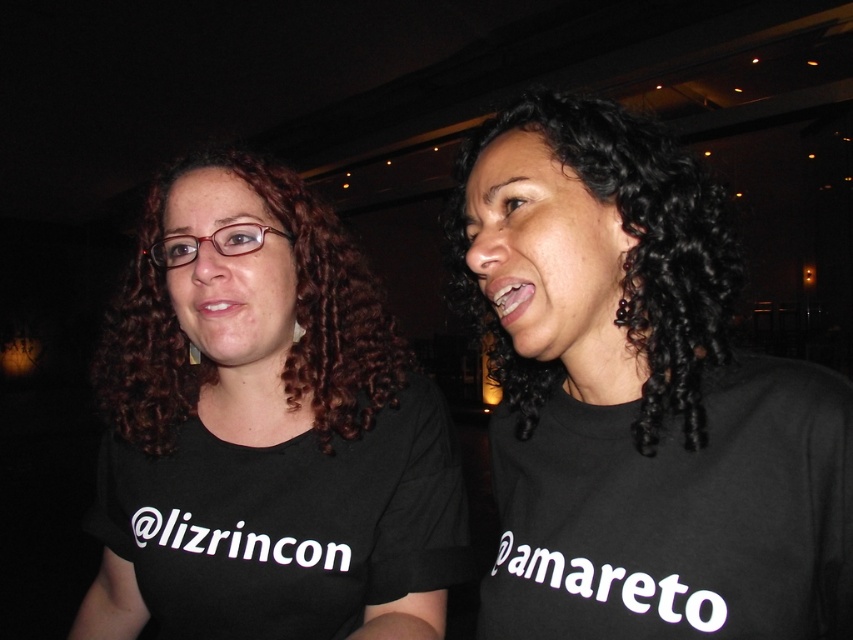
This screenshot has width=853, height=640. What do you see at coordinates (264, 429) in the screenshot?
I see `black matte t-shirt at left` at bounding box center [264, 429].

Based on the photo, between black matte t-shirt at left and black curly hair at center, which one is positioned higher?

black curly hair at center is above.

You are a GUI agent. You are given a task and a screenshot of the screen. Output one action in this format:
    pyautogui.click(x=<x>, y=<y>)
    Task: Click on the black matte t-shirt at left
    
    Given the screenshot: What is the action you would take?
    click(x=264, y=429)

At what (x,y) coordinates should I click in order to perform the action: click on black matte t-shirt at left. Please return your answer as a coordinate pair (x, y). This screenshot has width=853, height=640. Looking at the image, I should click on (264, 429).

Can you confirm if black matte shirt at center is positioned above black matte t-shirt at left?

Yes, black matte shirt at center is above black matte t-shirt at left.

Does black matte shirt at center have a larger size compared to black matte t-shirt at left?

No, black matte shirt at center is not bigger than black matte t-shirt at left.

At what (x,y) coordinates should I click in order to perform the action: click on black matte shirt at center. Please return your answer as a coordinate pair (x, y). This screenshot has height=640, width=853. Looking at the image, I should click on (639, 396).

Identify the location of black matte shirt at center. (639, 396).

Between black matte shirt at center and black cotton t-shirt at upper right, which one has less height?

With less height is black cotton t-shirt at upper right.

Between point (635, 499) and point (807, 632), which one is positioned behind?

The point (635, 499) is behind.

Find the location of `black matte shirt at center`. black matte shirt at center is located at coordinates (639, 396).